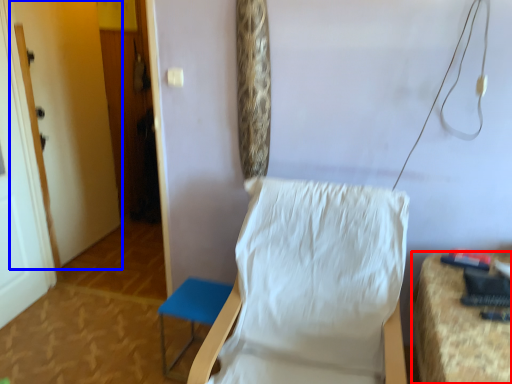
Question: Which point is closer to the camera, furniture (highlighted by a red box) or door (highlighted by a blue box)?

Choices:
 (A) furniture
 (B) door

Answer: (A)